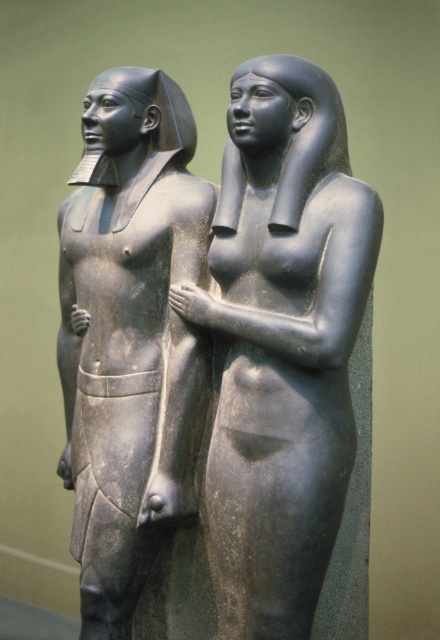
Question: Which point is farther from the camera taking this photo?

Choices:
 (A) (157, 296)
 (B) (275, 492)

Answer: (A)

Question: Can you confirm if matte black statue at center is smaller than matte black statue at left?

Choices:
 (A) no
 (B) yes

Answer: (A)

Question: Which object appears farthest from the camera in this image?

Choices:
 (A) matte black statue at left
 (B) matte black statue at center

Answer: (A)

Question: From the image, what is the correct spatial relationship of matte black statue at center in relation to matte black statue at left?

Choices:
 (A) right
 (B) left

Answer: (A)

Question: Where is matte black statue at center located in relation to matte black statue at left in the image?

Choices:
 (A) above
 (B) below

Answer: (A)